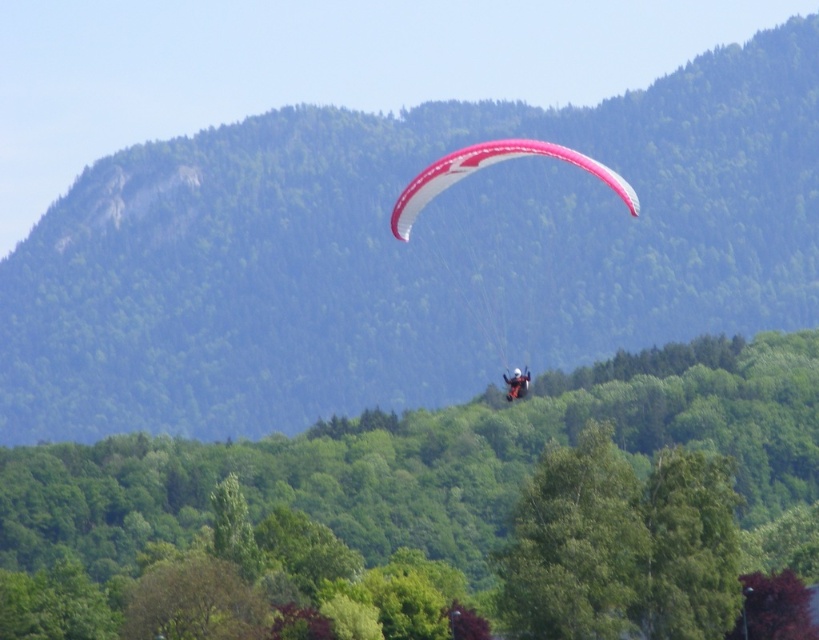
You are standing at the base of the green leafy hillside at center and want to reach the top. If your average walking speed is 3 km per hour, how long would it take you to walk up the hillside?

The green leafy hillside at center is 284.13 meters away from viewer. At an average walking speed of 3 km per hour, it would take approximately 5.68 minutes to walk up the hillside.

You are a hiker standing on the green leafy hillside at center and want to take a photo of the pink fabric parachute at center. Based on their relative sizes, which object would appear larger in your photo?

The green leafy hillside at center would appear larger in the photo because it is much taller than the pink fabric parachute at center.

You are a hiker standing at the base of the green leafy tree at center and want to reach the white matte parachute at upper center. Given that the parachute is 169.95 meters away, can you walk directly to it?

The distance between the green leafy tree at center and the white matte parachute at upper center is 169.95 meters. Since the parachute is in the sky, you cannot walk directly to it as it is airborne.